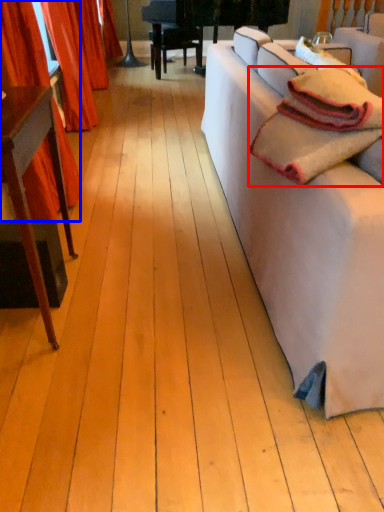
Question: Among these objects, which one is farthest to the camera, blanket (highlighted by a red box) or curtain (highlighted by a blue box)?

Choices:
 (A) blanket
 (B) curtain

Answer: (B)